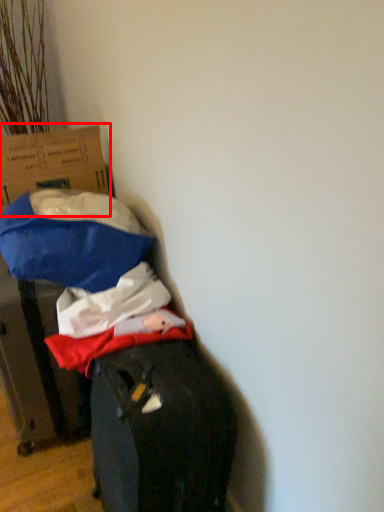
Question: Where is cardboard box (annotated by the red box) located in relation to cardboard box in the image?

Choices:
 (A) right
 (B) left

Answer: (B)